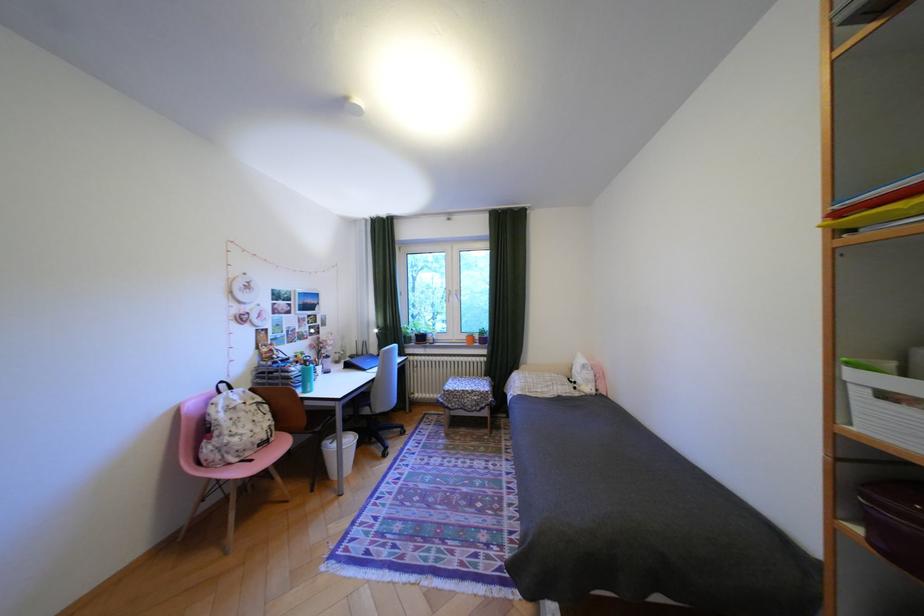
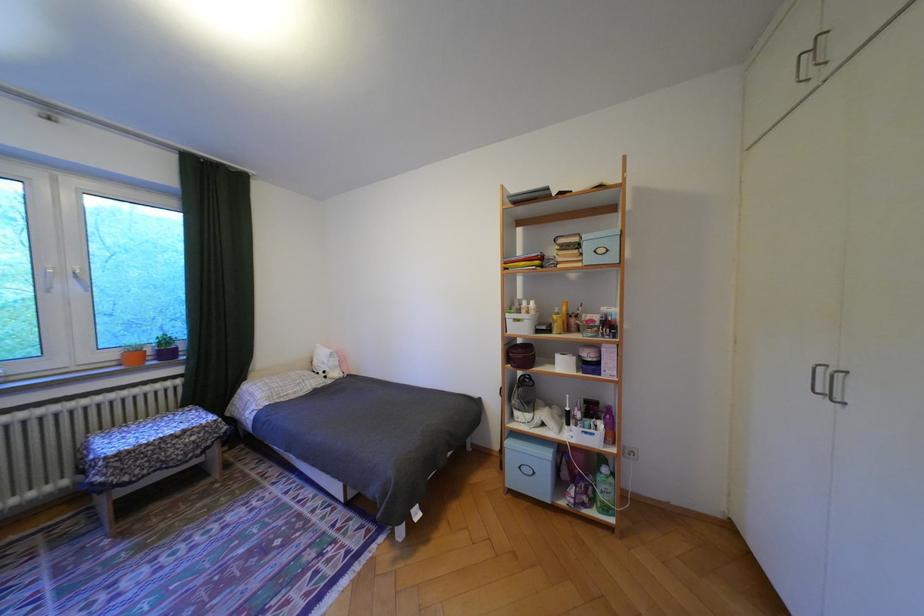
Where in the second image is the point corresponding to (x=476, y=337) from the first image?

(124, 355)